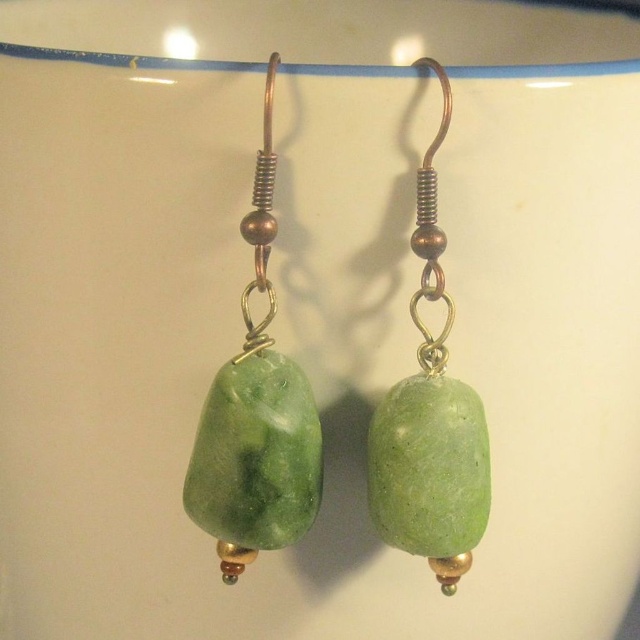
You are a jeweler examining the image of the earrings. You need to place a magnifying glass on the exact location of the green stone earring at left. What are the coordinates where you should place it?

The coordinates for the green stone earring at left are at point (x=256, y=417).

You are looking at two green stone earrings displayed against a plain background. The first is the green stone earring at left and the second is the green stone earring at center. Which one is more to the left?

The green stone earring at left is more to the left than the green stone earring at center.

You are trying to decide whether to buy the green stone earring at left for your collection. You have a display case that can only accommodate items within 3 feet from the viewer. Can this earring fit in your display case?

The green stone earring at left is 3.36 feet away from viewer, which exceeds the 3 feet limit of the display case. Therefore, it cannot fit within the display case.